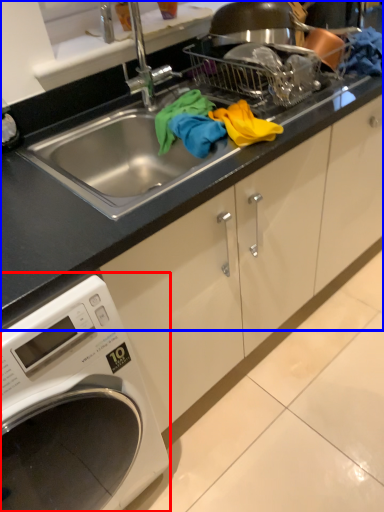
Question: Which point is closer to the camera, washing machine (highlighted by a red box) or countertop (highlighted by a blue box)?

Choices:
 (A) washing machine
 (B) countertop

Answer: (A)